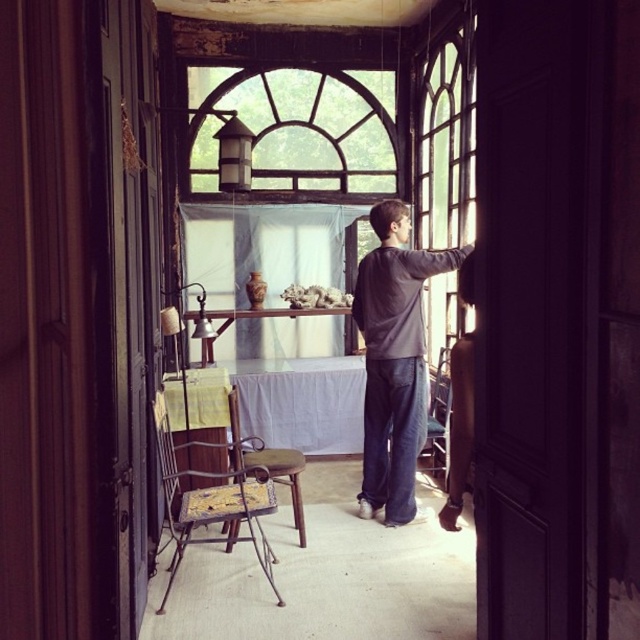
Who is more distant from viewer, (x=291, y=214) or (x=392, y=436)?

The point (x=291, y=214) is more distant.

What do you see at coordinates (262, 248) in the screenshot?
I see `white sheer curtain at center` at bounding box center [262, 248].

Identify the location of white sheer curtain at center. (262, 248).

Between clear glass window at center and wooden textured chair at center, which one has more height?

clear glass window at center

Who is more distant from viewer, (x=417, y=182) or (x=246, y=465)?

Point (x=417, y=182)

Image resolution: width=640 pixels, height=640 pixels. What are the coordinates of `clear glass window at center` in the screenshot? It's located at (445, 141).

Can you confirm if dark gray sweater at right is positioned below white cloth at center?

Incorrect, dark gray sweater at right is not positioned below white cloth at center.

Which is more to the right, dark gray sweater at right or white cloth at center?

Positioned to the right is dark gray sweater at right.

What do you see at coordinates (394, 360) in the screenshot? I see `dark gray sweater at right` at bounding box center [394, 360].

Locate an element on the screen. This screenshot has height=640, width=640. dark gray sweater at right is located at coordinates (394, 360).